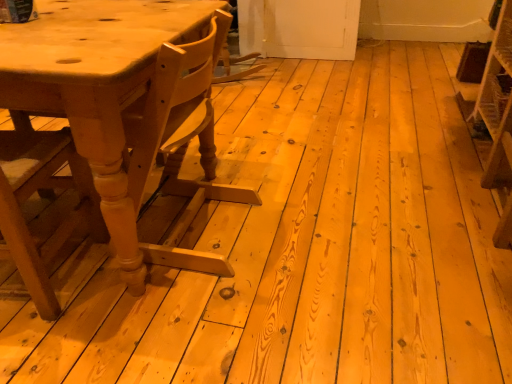
Question: Do you think light brown wood table at left is within wooden chair at left, or outside of it?

Choices:
 (A) outside
 (B) inside

Answer: (A)

Question: Based on their positions, is light brown wood table at left located to the left or right of wooden chair at left?

Choices:
 (A) right
 (B) left

Answer: (A)

Question: Estimate the real-world distances between objects in this image. Which object is farther from the wooden chair at left?

Choices:
 (A) wooden crate at right
 (B) light brown wood table at left

Answer: (A)

Question: Which object is positioned farthest from the wooden chair at left?

Choices:
 (A) wooden crate at right
 (B) light brown wood table at left

Answer: (A)